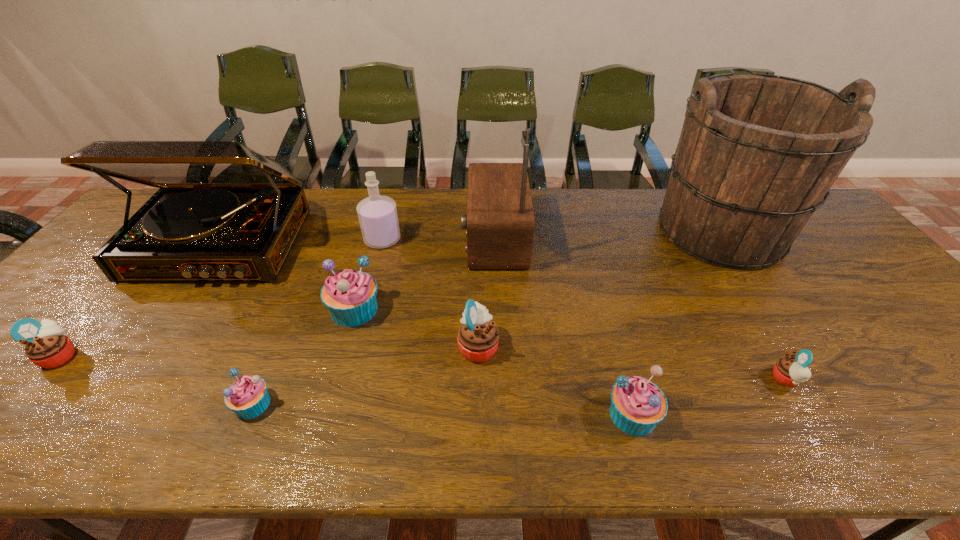
Select which pink muffin appears as the closest to the leftmost muffin. Please provide its 2D coordinates. Your answer should be formatted as a tuple, i.e. [(x, y)], where the tuple contains the x and y coordinates of a point satisfying the conditions above.

[(478, 337)]

Locate an element on the screen. The image size is (960, 540). the second closest pink muffin to the rightmost muffin is located at coordinates (47, 345).

Identify the location of free location that satisfies the following two spatial constraints: 1. on the front-facing side of the second biggest pink muffin; 2. on the back side of the second biggest blue muffin. (10, 415).

This screenshot has height=540, width=960. I want to click on free spot that satisfies the following two spatial constraints: 1. on the front-facing side of the radio receiver; 2. on the front-facing side of the record player, so click(495, 245).

I want to click on vacant space that satisfies the following two spatial constraints: 1. on the front-facing side of the radio receiver; 2. on the front side of the eighth object from right to left, so click(x=501, y=404).

Where is `vacant space that satisfies the following two spatial constraints: 1. on the front-facing side of the biggest blue muffin; 2. on the right side of the record player`? vacant space that satisfies the following two spatial constraints: 1. on the front-facing side of the biggest blue muffin; 2. on the right side of the record player is located at coordinates (178, 309).

Image resolution: width=960 pixels, height=540 pixels. What are the coordinates of `vacant space that satisfies the following two spatial constraints: 1. on the front side of the bucket; 2. on the front-facing side of the rightmost pink muffin` in the screenshot? It's located at (818, 379).

Find the location of a particular element. Image resolution: width=960 pixels, height=540 pixels. free space that satisfies the following two spatial constraints: 1. on the front-facing side of the second biggest pink muffin; 2. on the back side of the third object from left to right is located at coordinates (18, 404).